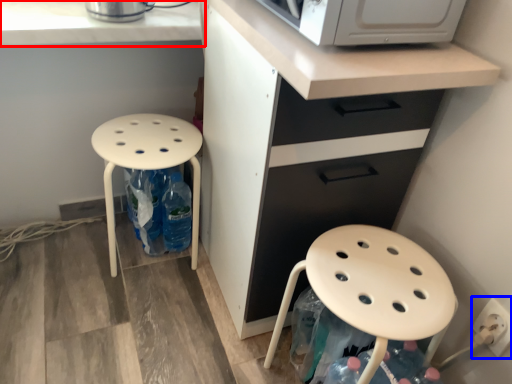
Question: Which of the following is the closest to the observer, countertop (highlighted by a red box) or electric outlet (highlighted by a blue box)?

Choices:
 (A) countertop
 (B) electric outlet

Answer: (B)